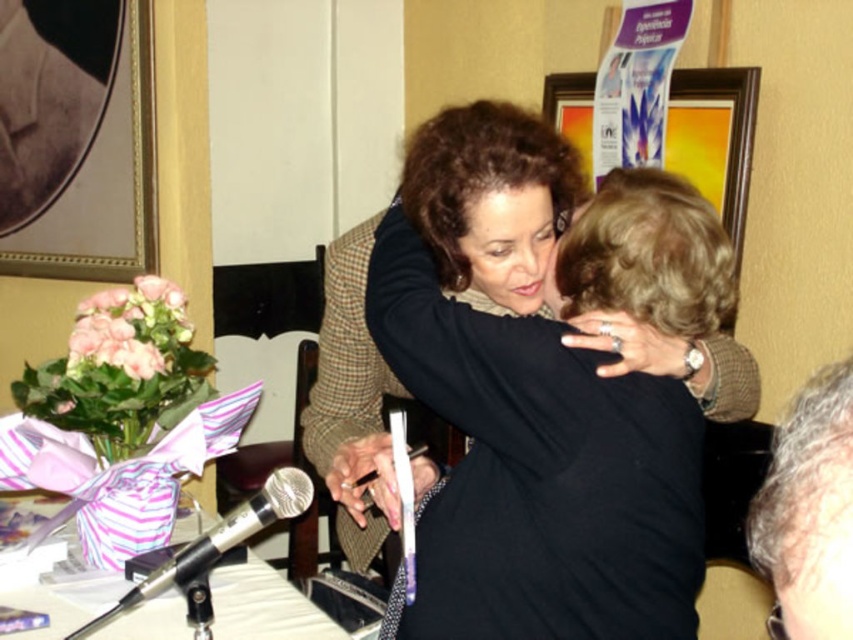
Question: Which point is closer to the camera?

Choices:
 (A) (722, 120)
 (B) (531, 592)

Answer: (B)

Question: Which point is farther to the camera?

Choices:
 (A) black matte shirt at center
 (B) gold/gilded picture frame at upper left
 (C) pink silk flowers at left
 (D) silver metallic microphone at lower center

Answer: (B)

Question: Can you confirm if wooden picture frame at upper center is positioned above silver metallic microphone at lower center?

Choices:
 (A) yes
 (B) no

Answer: (A)

Question: Based on their relative distances, which object is nearer to the gold/gilded picture frame at upper left?

Choices:
 (A) wooden picture frame at upper center
 (B) black matte shirt at center

Answer: (B)

Question: Is wooden picture frame at upper center wider than pink silk flowers at left?

Choices:
 (A) yes
 (B) no

Answer: (B)

Question: Does wooden picture frame at upper center appear over pink silk flowers at left?

Choices:
 (A) yes
 (B) no

Answer: (A)